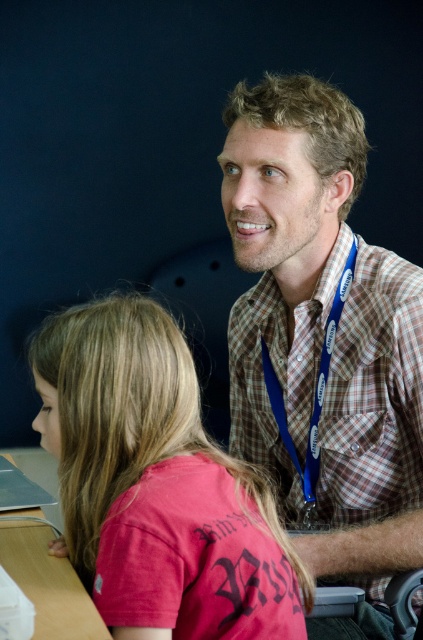
Question: Does plaid shirt at upper right come in front of blue fabric lanyard at upper center?

Choices:
 (A) yes
 (B) no

Answer: (A)

Question: Which object is the closest to the plaid shirt at upper right?

Choices:
 (A) blue fabric lanyard at upper center
 (B) matte pink shirt at lower left
 (C) wooden table at lower left

Answer: (A)

Question: Is matte pink shirt at lower left behind blue fabric lanyard at upper center?

Choices:
 (A) no
 (B) yes

Answer: (A)

Question: Is wooden table at lower left thinner than blue fabric lanyard at upper center?

Choices:
 (A) no
 (B) yes

Answer: (A)

Question: Which object is the farthest from the blue fabric lanyard at upper center?

Choices:
 (A) matte pink shirt at lower left
 (B) plaid shirt at upper right
 (C) wooden table at lower left

Answer: (C)

Question: Which point is farther from the camera taking this photo?

Choices:
 (A) (156, 352)
 (B) (71, 616)

Answer: (A)